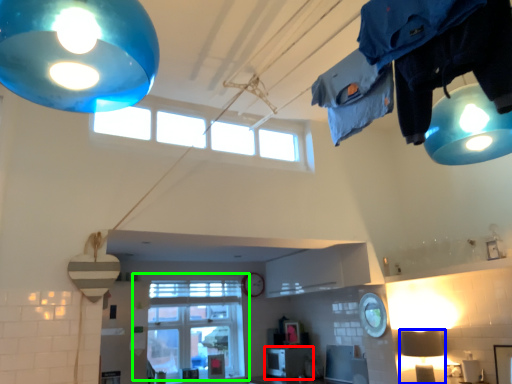
Question: Which object is positioned closest to appliance (highlighted by a red box)? Select from lamp (highlighted by a blue box) and window (highlighted by a green box).

Choices:
 (A) lamp
 (B) window

Answer: (B)